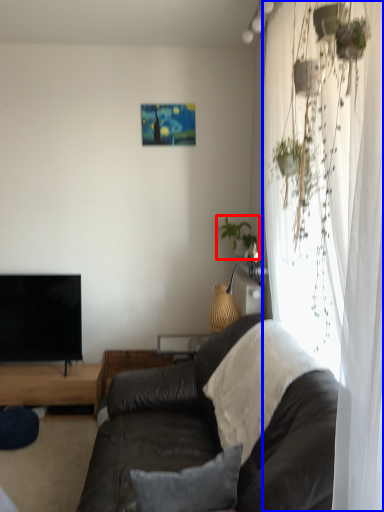
Question: Which object is further to the camera taking this photo, houseplant (highlighted by a red box) or curtain (highlighted by a blue box)?

Choices:
 (A) houseplant
 (B) curtain

Answer: (A)